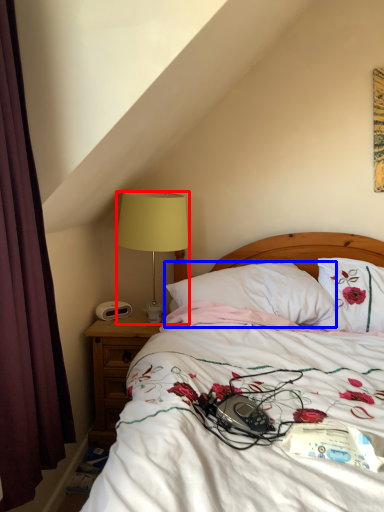
Question: Which of the following is the farthest to the observer, lamp (highlighted by a red box) or pillow (highlighted by a blue box)?

Choices:
 (A) lamp
 (B) pillow

Answer: (A)